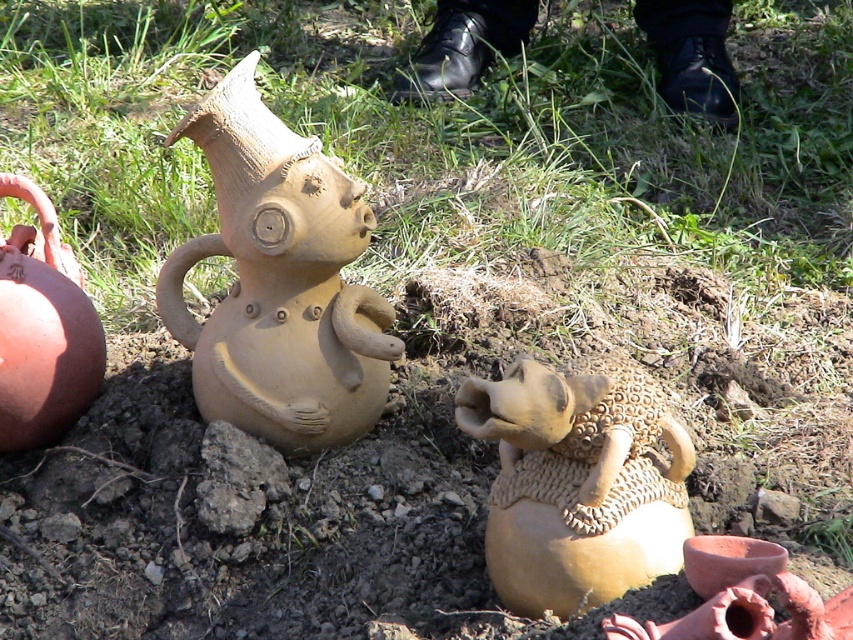
Question: Which object is closer to the camera taking this photo?

Choices:
 (A) matte clay pig at center
 (B) matte clay jug at left

Answer: (A)

Question: Considering the real-world distances, which object is farthest from the matte clay pig at center?

Choices:
 (A) matte clay figure at left
 (B) matte clay jug at left

Answer: (B)

Question: Does matte clay pig at center lie behind matte clay jug at left?

Choices:
 (A) no
 (B) yes

Answer: (A)

Question: Based on their relative distances, which object is nearer to the matte clay pig at center?

Choices:
 (A) matte clay figure at left
 (B) matte clay jug at left

Answer: (A)

Question: From the image, what is the correct spatial relationship of matte clay figure at left in relation to matte clay pig at center?

Choices:
 (A) below
 (B) above

Answer: (B)

Question: Is matte clay pig at center wider than matte clay jug at left?

Choices:
 (A) yes
 (B) no

Answer: (A)